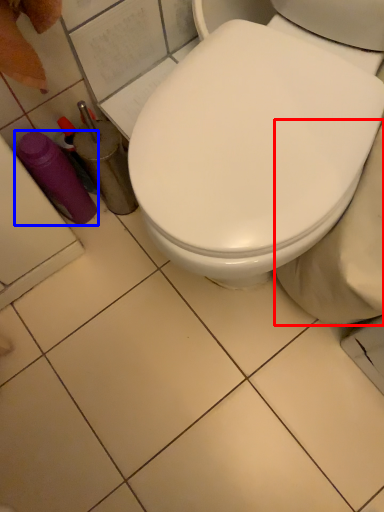
Question: Which of the following is the farthest to the observer, bidet (highlighted by a red box) or bottle (highlighted by a blue box)?

Choices:
 (A) bidet
 (B) bottle

Answer: (B)